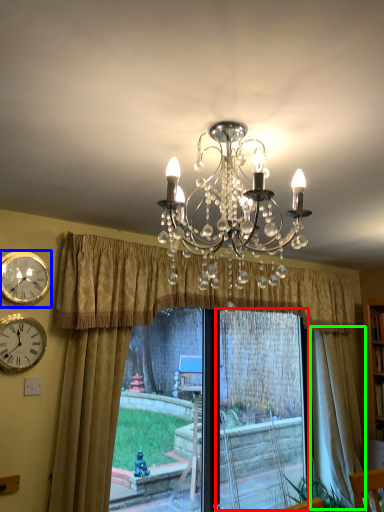
Question: Which object is positioned closest to window frame (highlighted by a red box)? Select from wall clock (highlighted by a blue box) and curtain (highlighted by a green box).

Choices:
 (A) wall clock
 (B) curtain

Answer: (B)